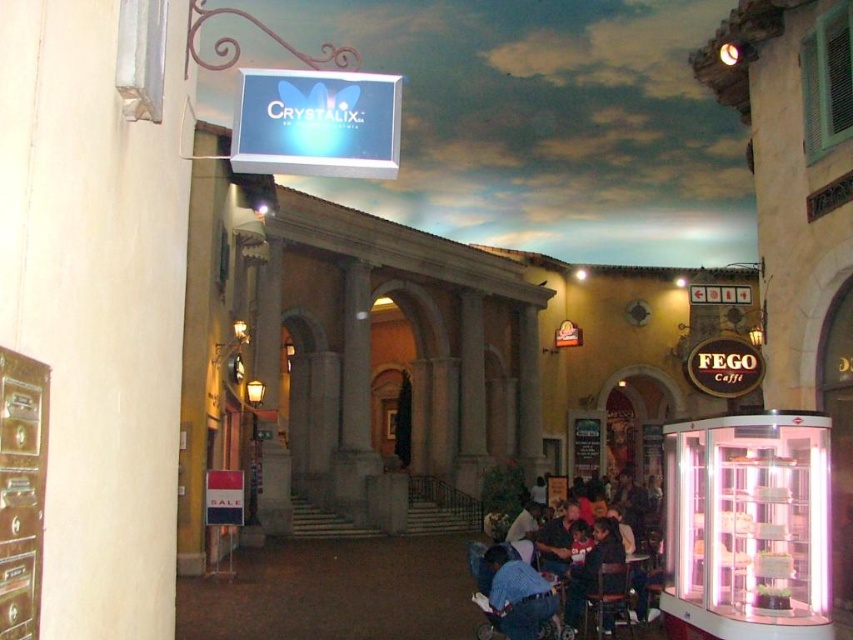
Question: Based on their relative distances, which object is farther from the blue denim shirt at center?

Choices:
 (A) dark blue shirt at lower right
 (B) blue denim shirt at lower center

Answer: (B)

Question: Which point is closer to the camera?

Choices:
 (A) (521, 625)
 (B) (573, 625)
 (C) (477, 564)

Answer: (A)

Question: Can you confirm if blue denim shirt at center is smaller than blue denim shirt at lower center?

Choices:
 (A) yes
 (B) no

Answer: (B)

Question: Which object is positioned closest to the dark blue shirt at lower right?

Choices:
 (A) blue denim shirt at lower center
 (B) blue denim shirt at center

Answer: (A)

Question: Considering the relative positions of blue denim shirt at center and blue denim shirt at lower center in the image provided, where is blue denim shirt at center located with respect to blue denim shirt at lower center?

Choices:
 (A) left
 (B) right

Answer: (B)

Question: Does blue denim shirt at center have a larger size compared to dark blue shirt at lower right?

Choices:
 (A) no
 (B) yes

Answer: (B)